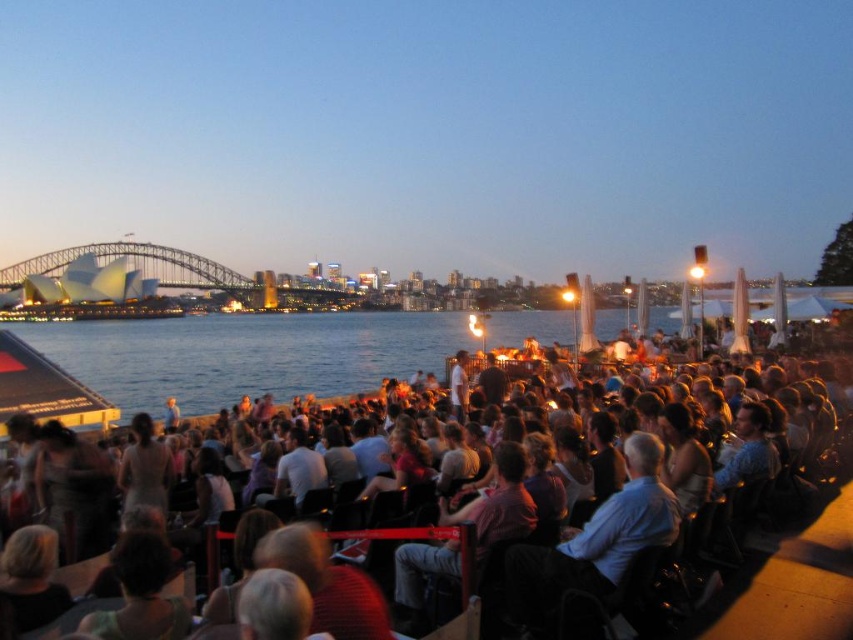
Question: Is dark blue water at center further to the viewer compared to matte black chairs at center?

Choices:
 (A) no
 (B) yes

Answer: (B)

Question: Can you confirm if dark blue water at center is thinner than matte black chairs at center?

Choices:
 (A) no
 (B) yes

Answer: (B)

Question: From the image, what is the correct spatial relationship of dark blue water at center in relation to matte black chairs at center?

Choices:
 (A) above
 (B) below

Answer: (A)

Question: Among these objects, which one is farthest from the camera?

Choices:
 (A) dark blue water at center
 (B) matte black chairs at center

Answer: (A)

Question: Which object appears closest to the camera in this image?

Choices:
 (A) matte black chairs at center
 (B) dark blue water at center

Answer: (A)